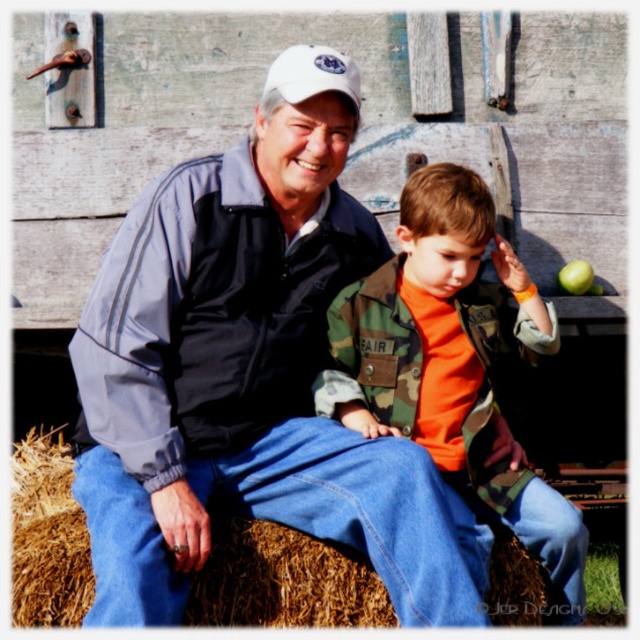
Question: Among these objects, which one is nearest to the camera?

Choices:
 (A) camouflage jacket at center
 (B) green matte apple at upper right
 (C) matte blue jacket at center

Answer: (C)

Question: Which point is farther to the camera?

Choices:
 (A) (442, 285)
 (B) (141, 548)
 (C) (348, 84)

Answer: (A)

Question: Does camouflage jacket at center appear under brown straw bale at center?

Choices:
 (A) yes
 (B) no

Answer: (B)

Question: Estimate the real-world distances between objects in this image. Which object is farther from the brown straw bale at center?

Choices:
 (A) matte blue jacket at center
 (B) white matte baseball cap at upper center
 (C) camouflage jacket at center

Answer: (B)

Question: Where is matte blue jacket at center located in relation to camouflage jacket at center in the image?

Choices:
 (A) right
 (B) left

Answer: (B)

Question: From the image, what is the correct spatial relationship of matte blue jacket at center in relation to white matte baseball cap at upper center?

Choices:
 (A) below
 (B) above

Answer: (A)